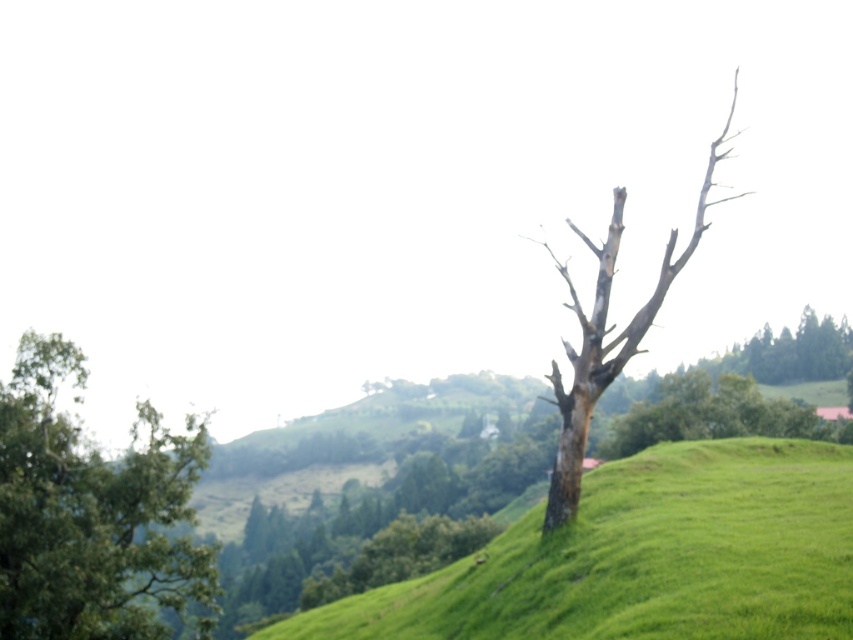
Between point (851, 524) and point (96, 452), which one is positioned behind?

The point (96, 452) is behind.

Consider the image. Measure the distance between green grassy hillside at center and green leafy tree at left.

green grassy hillside at center is 7.76 meters from green leafy tree at left.

The width and height of the screenshot is (853, 640). What do you see at coordinates (643, 557) in the screenshot?
I see `green grassy hillside at center` at bounding box center [643, 557].

Locate an element on the screen. green grassy hillside at center is located at coordinates (643, 557).

Is point (141, 541) more distant than point (558, 385)?

Yes, point (141, 541) is farther from viewer.

Which is behind, point (41, 497) or point (577, 483)?

The point (41, 497) is more distant.

Image resolution: width=853 pixels, height=640 pixels. Find the location of `green leafy tree at left`. green leafy tree at left is located at coordinates (90, 513).

Is green grassy hillside at center to the left of dead wood tree at right from the viewer's perspective?

Correct, you'll find green grassy hillside at center to the left of dead wood tree at right.

Can you confirm if green grassy hillside at center is bigger than dead wood tree at right?

No, green grassy hillside at center is not bigger than dead wood tree at right.

This screenshot has height=640, width=853. In order to click on green grassy hillside at center in this screenshot , I will do `click(643, 557)`.

Where is `green grassy hillside at center`? green grassy hillside at center is located at coordinates (643, 557).